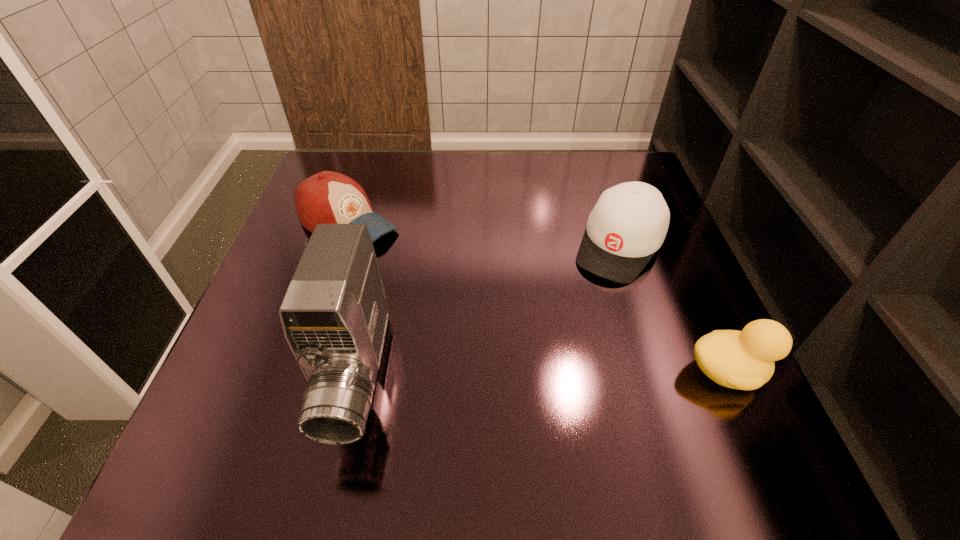
Where is `object present at the far edge`? The width and height of the screenshot is (960, 540). object present at the far edge is located at coordinates pyautogui.click(x=327, y=197).

Where is `camcorder that is positioned at the near edge`? The width and height of the screenshot is (960, 540). camcorder that is positioned at the near edge is located at coordinates tap(334, 315).

You are a GUI agent. You are given a task and a screenshot of the screen. Output one action in this format:
    pyautogui.click(x=<x>, y=<y>)
    Task: Click on the duck present at the near edge
    
    Given the screenshot: What is the action you would take?
    pyautogui.click(x=744, y=360)

The image size is (960, 540). Find the location of `object that is positioned at the left edge`. object that is positioned at the left edge is located at coordinates (327, 197).

Where is `duck located at the right edge`? This screenshot has width=960, height=540. duck located at the right edge is located at coordinates (744, 360).

Locate an element on the screen. The width and height of the screenshot is (960, 540). baseball cap present at the right edge is located at coordinates (628, 224).

The width and height of the screenshot is (960, 540). Find the location of `object positioned at the far left corner`. object positioned at the far left corner is located at coordinates (327, 197).

Identify the location of object positioned at the near right corner. The height and width of the screenshot is (540, 960). tap(744, 360).

Image resolution: width=960 pixels, height=540 pixels. In order to click on vacant point at the far edge in this screenshot , I will do `click(425, 152)`.

Where is `free location at the near edge of the desktop`? free location at the near edge of the desktop is located at coordinates (512, 401).